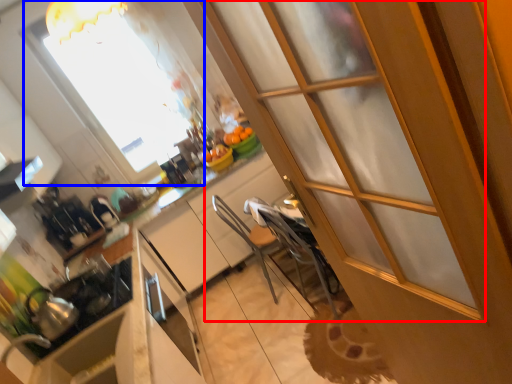
Question: Among these objects, which one is farthest to the camera, screen door (highlighted by a red box) or window (highlighted by a blue box)?

Choices:
 (A) screen door
 (B) window

Answer: (B)